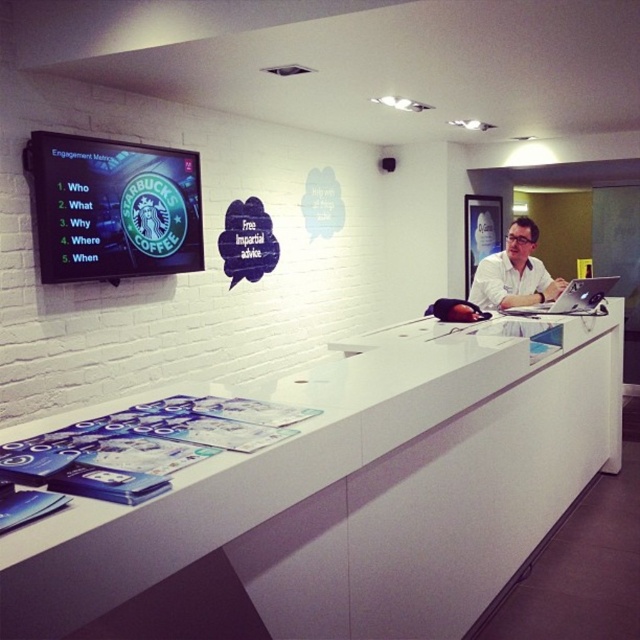
You are a customer standing in front of the reception desk and see the white smooth shirt at center and the sleek silver laptop at center. Which item is closer to you?

The white smooth shirt at center is closer to you because it is positioned further to the viewer than the sleek silver laptop at center.

You are a customer standing in front of the reception desk and see the white smooth shirt at center and the sleek silver laptop at center. Which object is taller?

The white smooth shirt at center is much taller than the sleek silver laptop at center.

You are standing at the entrance of the office and want to approach the white glossy counter at center. Which direction should you move relative to the entrance?

The white glossy counter at center is located at point (324,490), so you should move towards the center of the office to reach it.